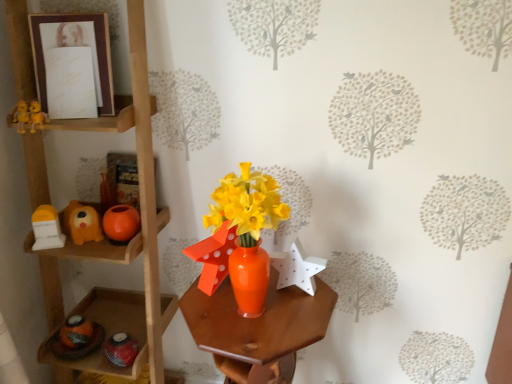
Question: In which direction should I rotate to look at white matte star at center, the first toy viewed from the right?

Choices:
 (A) left
 (B) right

Answer: (B)

Question: Is orange glossy vase at center turned away from matte brown picture frame at upper left?

Choices:
 (A) yes
 (B) no

Answer: (B)

Question: Does orange glossy vase at center appear on the right side of matte brown picture frame at upper left?

Choices:
 (A) yes
 (B) no

Answer: (A)

Question: Is orange glossy vase at center touching matte brown picture frame at upper left?

Choices:
 (A) yes
 (B) no

Answer: (B)

Question: Considering the relative positions of orange glossy vase at center and matte brown picture frame at upper left in the image provided, is orange glossy vase at center behind matte brown picture frame at upper left?

Choices:
 (A) yes
 (B) no

Answer: (B)

Question: Is orange glossy vase at center smaller than matte brown picture frame at upper left?

Choices:
 (A) no
 (B) yes

Answer: (A)

Question: From the image's perspective, is orange glossy vase at center on top of matte brown picture frame at upper left?

Choices:
 (A) yes
 (B) no

Answer: (B)

Question: Does matte orange dog at left, positioned as the third toy in right-to-left order, turn towards white matte star at center, the first toy viewed from the right?

Choices:
 (A) yes
 (B) no

Answer: (B)

Question: From a real-world perspective, is matte orange dog at left, positioned as the third toy in right-to-left order, positioned under white matte star at center, the first toy viewed from the right, based on gravity?

Choices:
 (A) no
 (B) yes

Answer: (A)

Question: Is matte orange dog at left, the first toy when ordered from left to right, outside white matte star at center, the first toy viewed from the right?

Choices:
 (A) yes
 (B) no

Answer: (A)

Question: Is matte orange dog at left, positioned as the third toy in right-to-left order, further to the viewer compared to white matte star at center, the first toy viewed from the right?

Choices:
 (A) yes
 (B) no

Answer: (A)

Question: From the image's perspective, is matte orange dog at left, the first toy when ordered from left to right, over white matte star at center, the first toy viewed from the right?

Choices:
 (A) yes
 (B) no

Answer: (A)

Question: Would you say matte orange dog at left, positioned as the third toy in right-to-left order, contains white matte star at center, which is counted as the third toy, starting from the left?

Choices:
 (A) yes
 (B) no

Answer: (B)

Question: Can you confirm if orange matte ball at left, acting as the 2th toy starting from the left, is positioned to the right of matte brown picture frame at upper left?

Choices:
 (A) no
 (B) yes

Answer: (B)